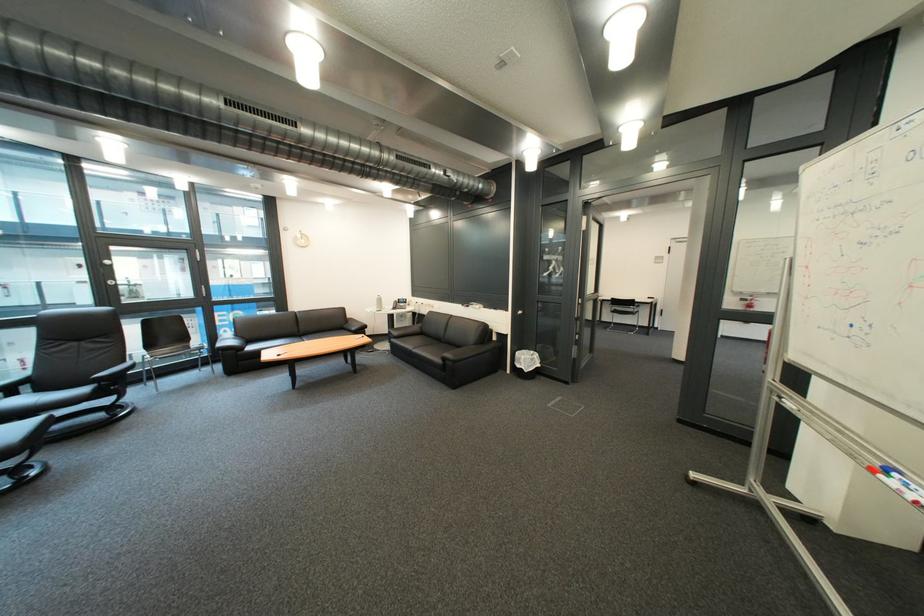
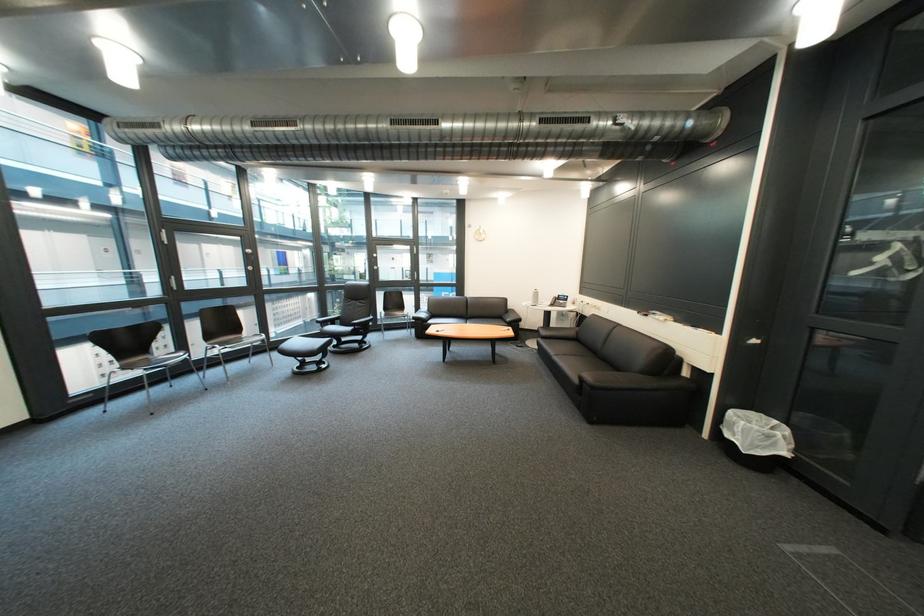
Find the pixel in the second image that matches [536,363] in the first image.

(751, 431)